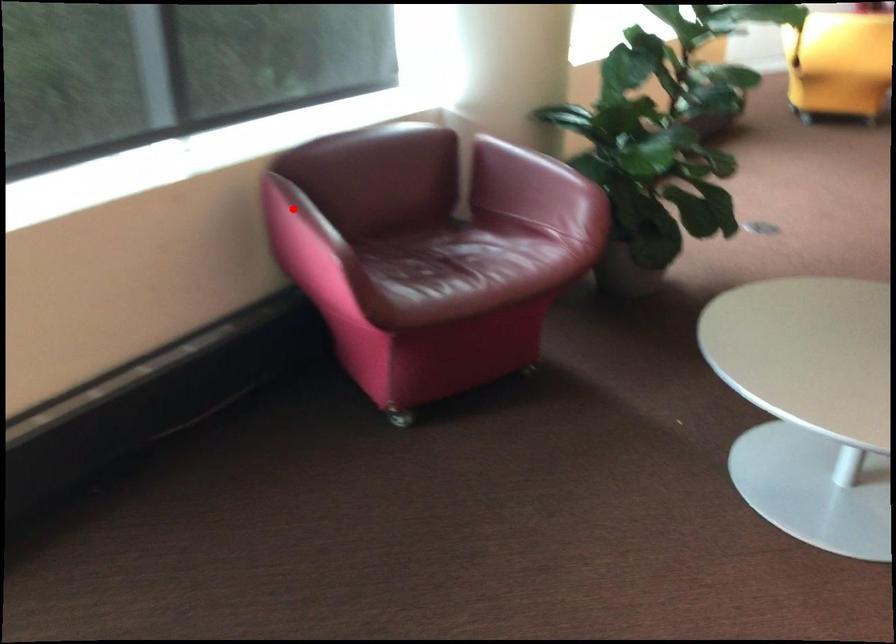
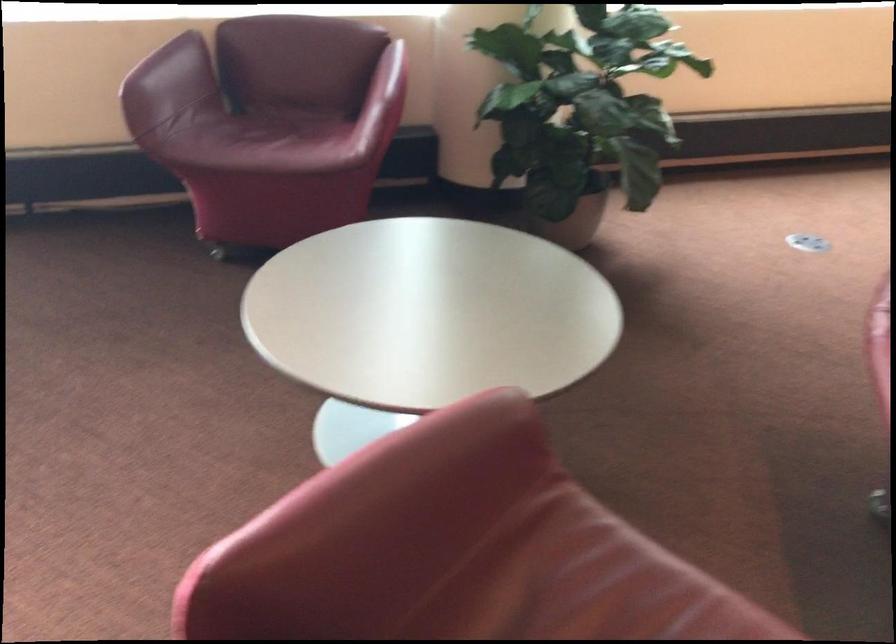
The point at the highlighted location is marked in the first image. Where is the corresponding point in the second image?

(165, 57)